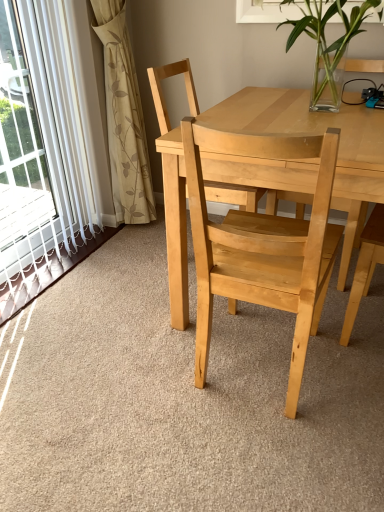
Locate an element on the screen. This screenshot has height=512, width=384. vacant space in beige floral fabric curtain at left (from a real-world perspective) is located at coordinates coord(130,233).